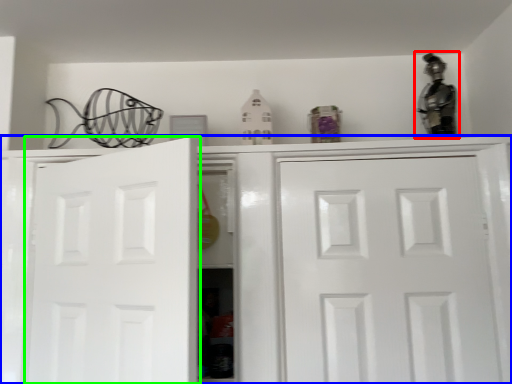
Question: Which object is positioned closest to figurine (highlighted by a red box)? Select from cabinetry (highlighted by a blue box) and door (highlighted by a green box).

Choices:
 (A) cabinetry
 (B) door

Answer: (A)